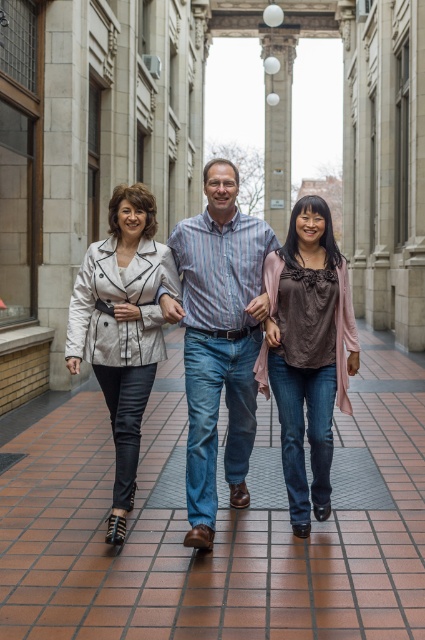
The image size is (425, 640). Find the location of `striped cotton shirt at center`. striped cotton shirt at center is located at coordinates (218, 339).

Which is more to the right, striped cotton shirt at center or matte white blazer at center?

striped cotton shirt at center

Does point (237, 422) lie behind point (130, 408)?

Yes, point (237, 422) is behind point (130, 408).

Where is `striped cotton shirt at center`? Image resolution: width=425 pixels, height=640 pixels. striped cotton shirt at center is located at coordinates (218, 339).

Which is more to the left, brown tile pavement at center or brown matte top at center?

brown matte top at center is more to the left.

This screenshot has height=640, width=425. What are the coordinates of `brown tile pavement at center` in the screenshot? It's located at (215, 531).

Is striped cotton shirt at center below brown matte top at center?

Incorrect, striped cotton shirt at center is not positioned below brown matte top at center.

Who is more forward, (193, 256) or (297, 413)?

Positioned in front is point (297, 413).

Locate an element on the screen. Image resolution: width=425 pixels, height=640 pixels. striped cotton shirt at center is located at coordinates (218, 339).